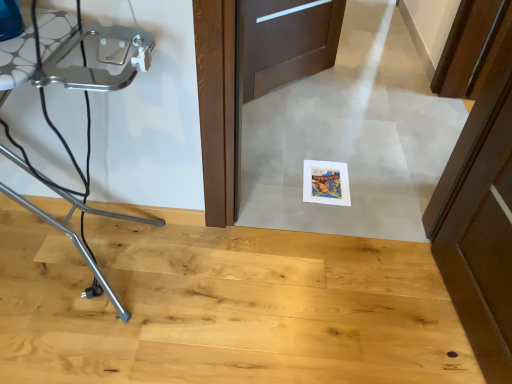
Where is `empty space that is to the right of metallic silver tripod at left`? The image size is (512, 384). empty space that is to the right of metallic silver tripod at left is located at coordinates (229, 298).